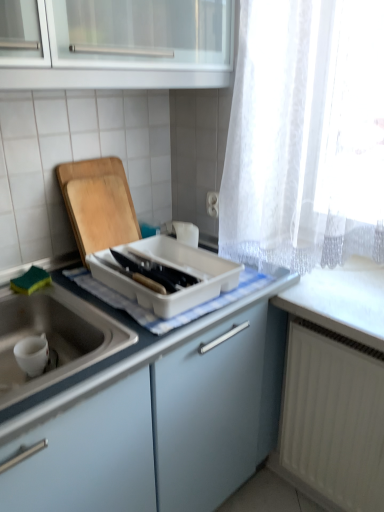
Question: Is wooden cutting board at left outside white matte sink at lower left?

Choices:
 (A) yes
 (B) no

Answer: (A)

Question: From a real-world perspective, is wooden cutting board at left under white matte sink at lower left?

Choices:
 (A) no
 (B) yes

Answer: (A)

Question: From the image's perspective, is wooden cutting board at left on white matte sink at lower left?

Choices:
 (A) yes
 (B) no

Answer: (A)

Question: Are wooden cutting board at left and white matte sink at lower left located far from each other?

Choices:
 (A) yes
 (B) no

Answer: (B)

Question: Considering the relative sizes of wooden cutting board at left and white matte sink at lower left in the image provided, is wooden cutting board at left shorter than white matte sink at lower left?

Choices:
 (A) no
 (B) yes

Answer: (A)

Question: In terms of height, does white matte sink at lower left look taller or shorter compared to white matte radiator at lower right?

Choices:
 (A) short
 (B) tall

Answer: (A)

Question: Looking at the image, does white matte sink at lower left seem bigger or smaller compared to white matte radiator at lower right?

Choices:
 (A) big
 (B) small

Answer: (A)

Question: Considering the positions of white matte sink at lower left and white matte radiator at lower right in the image, is white matte sink at lower left wider or thinner than white matte radiator at lower right?

Choices:
 (A) thin
 (B) wide

Answer: (B)

Question: In the image, is white matte sink at lower left positioned in front of or behind white matte radiator at lower right?

Choices:
 (A) front
 (B) behind

Answer: (A)

Question: From their relative heights in the image, would you say white matte sink at lower left is taller or shorter than white plastic tray at center?

Choices:
 (A) short
 (B) tall

Answer: (B)

Question: Considering the positions of white matte sink at lower left and white plastic tray at center in the image, is white matte sink at lower left wider or thinner than white plastic tray at center?

Choices:
 (A) wide
 (B) thin

Answer: (A)

Question: From the image's perspective, is white matte sink at lower left positioned above or below white plastic tray at center?

Choices:
 (A) below
 (B) above

Answer: (A)

Question: Relative to white plastic tray at center, is white matte sink at lower left in front or behind?

Choices:
 (A) front
 (B) behind

Answer: (A)

Question: Is point (86, 256) positioned closer to the camera than point (107, 400)?

Choices:
 (A) closer
 (B) farther

Answer: (B)

Question: From the image's perspective, relative to white matte sink at lower left, is white plastic tray at center above or below?

Choices:
 (A) below
 (B) above

Answer: (B)